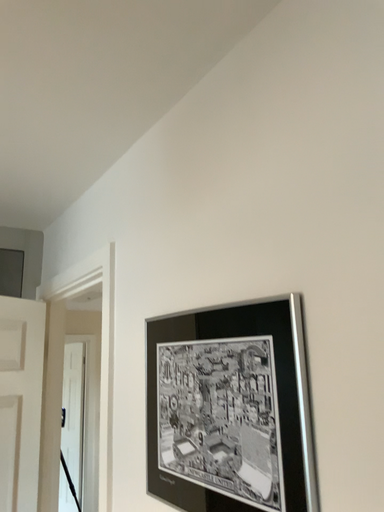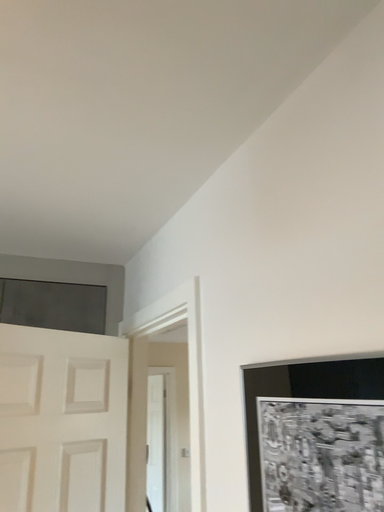
Question: Which way did the camera rotate in the video?

Choices:
 (A) rotated right
 (B) rotated left

Answer: (B)